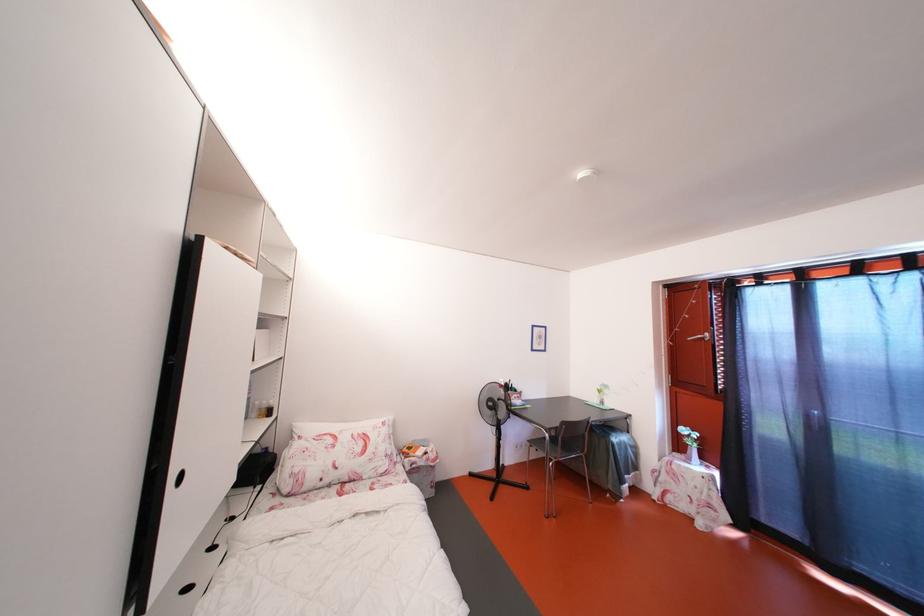
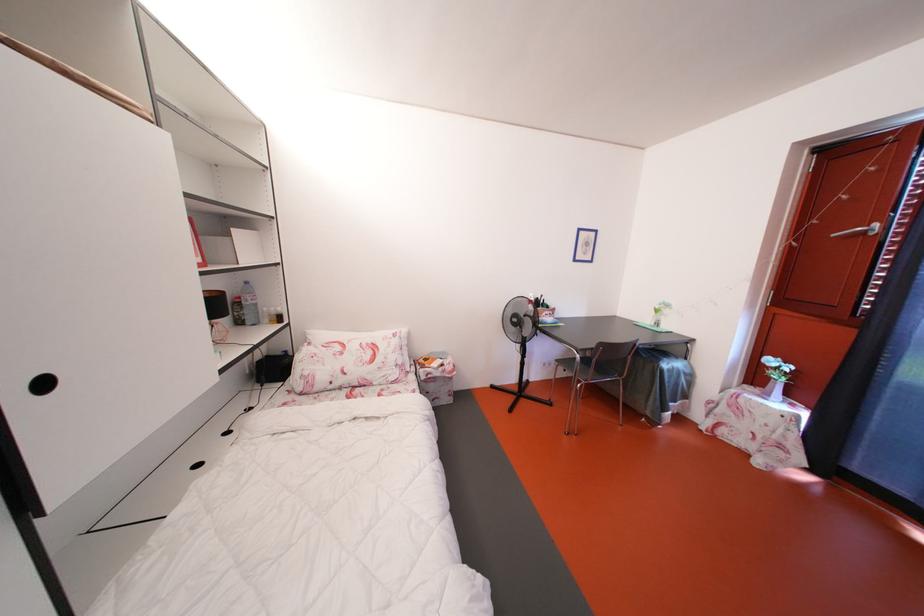
Question: The first image is from the beginning of the video and the second image is from the end. How did the camera likely rotate when shooting the video?

Choices:
 (A) Left
 (B) Right
 (C) Up
 (D) Down

Answer: (D)